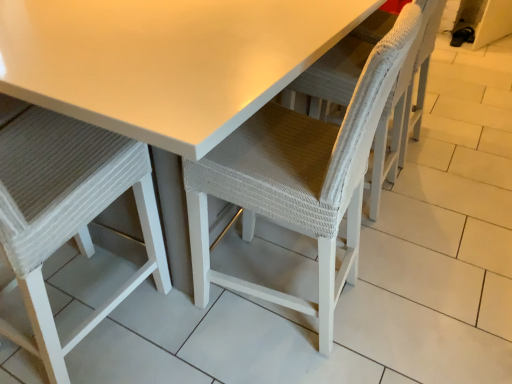
Question: From a real-world perspective, does white matte table at center stand above white woven chair at center, acting as the first chair starting from the right?

Choices:
 (A) yes
 (B) no

Answer: (B)

Question: From a real-world perspective, is white matte table at center located beneath white woven chair at center, the 2th chair viewed from the left?

Choices:
 (A) yes
 (B) no

Answer: (A)

Question: Is white matte table at center touching white woven chair at center, the 2th chair viewed from the left?

Choices:
 (A) no
 (B) yes

Answer: (A)

Question: Considering the relative sizes of white matte table at center and white woven chair at center, acting as the first chair starting from the right, in the image provided, is white matte table at center smaller than white woven chair at center, acting as the first chair starting from the right,?

Choices:
 (A) yes
 (B) no

Answer: (B)

Question: Is white matte table at center positioned with its back to white woven chair at center, acting as the first chair starting from the right?

Choices:
 (A) yes
 (B) no

Answer: (B)

Question: From the image's perspective, is white matte table at center beneath white woven chair at center, the 2th chair viewed from the left?

Choices:
 (A) no
 (B) yes

Answer: (A)

Question: Is white matte table at center surrounded by white woven chair at left, placed as the first chair when sorted from left to right?

Choices:
 (A) yes
 (B) no

Answer: (B)

Question: Is white woven chair at left, placed as the first chair when sorted from left to right, positioned with its back to white matte table at center?

Choices:
 (A) yes
 (B) no

Answer: (A)

Question: Considering the relative sizes of white woven chair at left, which is counted as the 2th chair, starting from the right, and white matte table at center in the image provided, is white woven chair at left, which is counted as the 2th chair, starting from the right, smaller than white matte table at center?

Choices:
 (A) yes
 (B) no

Answer: (A)

Question: Considering the relative sizes of white woven chair at left, placed as the first chair when sorted from left to right, and white matte table at center in the image provided, is white woven chair at left, placed as the first chair when sorted from left to right, shorter than white matte table at center?

Choices:
 (A) no
 (B) yes

Answer: (A)

Question: From the image's perspective, is white woven chair at left, placed as the first chair when sorted from left to right, on white matte table at center?

Choices:
 (A) no
 (B) yes

Answer: (A)

Question: Is white woven chair at left, placed as the first chair when sorted from left to right, at the left side of white matte table at center?

Choices:
 (A) yes
 (B) no

Answer: (A)

Question: Is white matte table at center touching white woven chair at left, placed as the first chair when sorted from left to right?

Choices:
 (A) yes
 (B) no

Answer: (B)